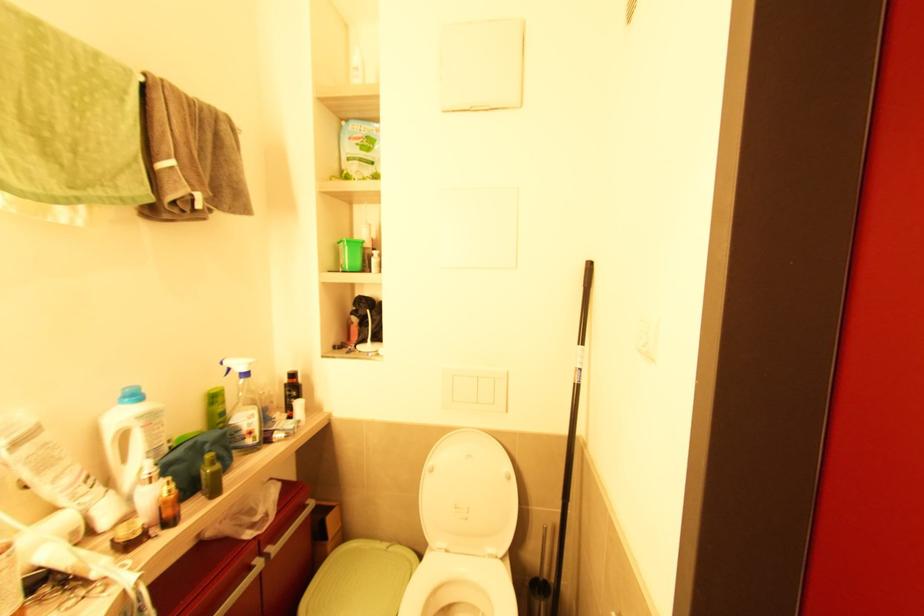
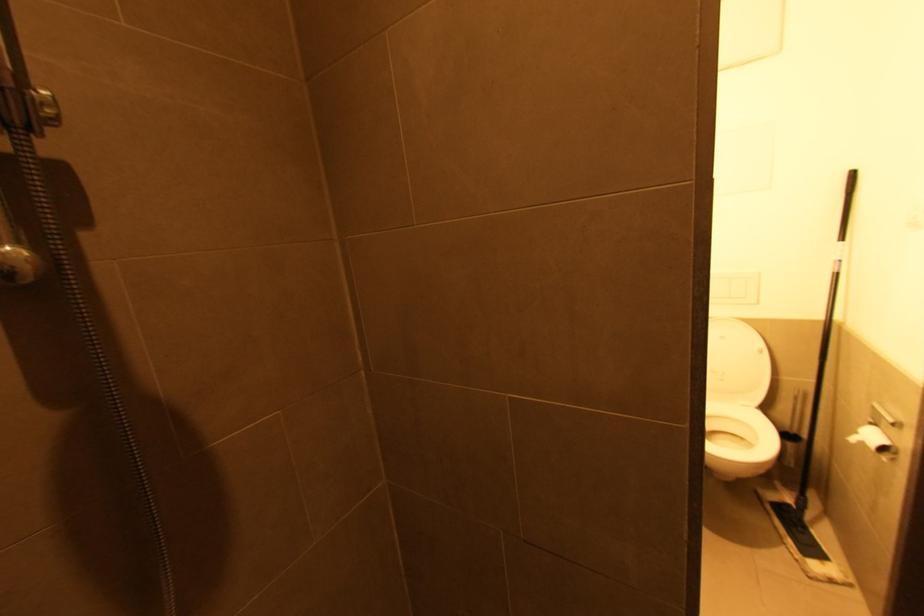
Question: The first image is from the beginning of the video and the second image is from the end. How did the camera likely rotate when shooting the video?

Choices:
 (A) Left
 (B) Right
 (C) Up
 (D) Down

Answer: (A)